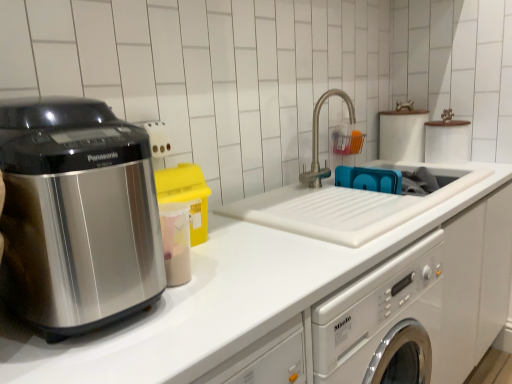
Question: From the image's perspective, is brushed metal faucet at center above satin metallic appliance at left?

Choices:
 (A) no
 (B) yes

Answer: (B)

Question: Does brushed metal faucet at center contain satin metallic appliance at left?

Choices:
 (A) yes
 (B) no

Answer: (B)

Question: From the image's perspective, is brushed metal faucet at center beneath satin metallic appliance at left?

Choices:
 (A) no
 (B) yes

Answer: (A)

Question: Considering the relative sizes of brushed metal faucet at center and satin metallic appliance at left in the image provided, is brushed metal faucet at center smaller than satin metallic appliance at left?

Choices:
 (A) yes
 (B) no

Answer: (A)

Question: Is brushed metal faucet at center to the left of satin metallic appliance at left from the viewer's perspective?

Choices:
 (A) no
 (B) yes

Answer: (A)

Question: Looking at their shapes, would you say satin metallic appliance at left is wider or thinner than white matte countertop at center?

Choices:
 (A) wide
 (B) thin

Answer: (B)

Question: Considering the positions of point (33, 273) and point (2, 357), is point (33, 273) closer or farther from the camera than point (2, 357)?

Choices:
 (A) farther
 (B) closer

Answer: (A)

Question: Visually, is satin metallic appliance at left positioned to the left or to the right of white matte countertop at center?

Choices:
 (A) right
 (B) left

Answer: (B)

Question: Is satin metallic appliance at left bigger or smaller than white matte countertop at center?

Choices:
 (A) big
 (B) small

Answer: (B)

Question: Is white matte countertop at center bigger or smaller than satin metallic appliance at left?

Choices:
 (A) big
 (B) small

Answer: (A)

Question: Is white matte countertop at center taller or shorter than satin metallic appliance at left?

Choices:
 (A) tall
 (B) short

Answer: (A)

Question: In the image, is white matte countertop at center on the left side or the right side of satin metallic appliance at left?

Choices:
 (A) right
 (B) left

Answer: (A)

Question: From the image's perspective, is white matte countertop at center located above or below satin metallic appliance at left?

Choices:
 (A) above
 (B) below

Answer: (B)

Question: Based on their sizes in the image, would you say brushed metal faucet at center is bigger or smaller than satin metallic appliance at left?

Choices:
 (A) small
 (B) big

Answer: (A)

Question: From a real-world perspective, relative to satin metallic appliance at left, is brushed metal faucet at center vertically above or below?

Choices:
 (A) above
 (B) below

Answer: (B)